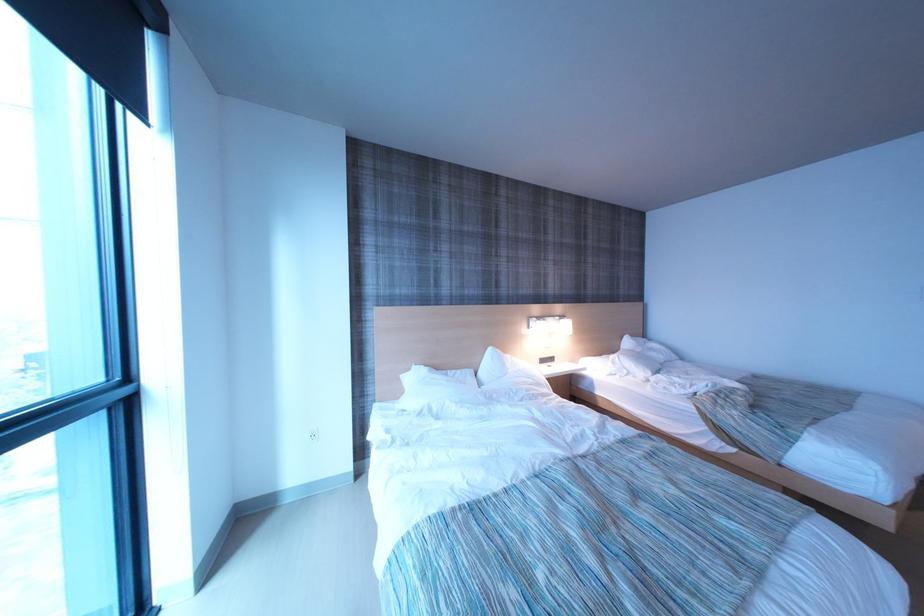
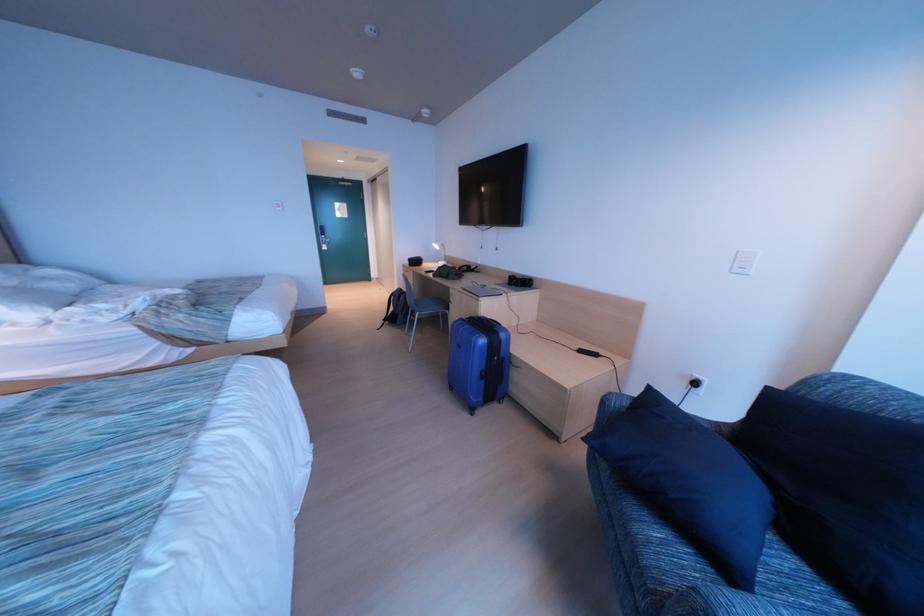
The first image is from the beginning of the video and the second image is from the end. How did the camera likely rotate when shooting the video?

The rotation direction of the camera is right-down.